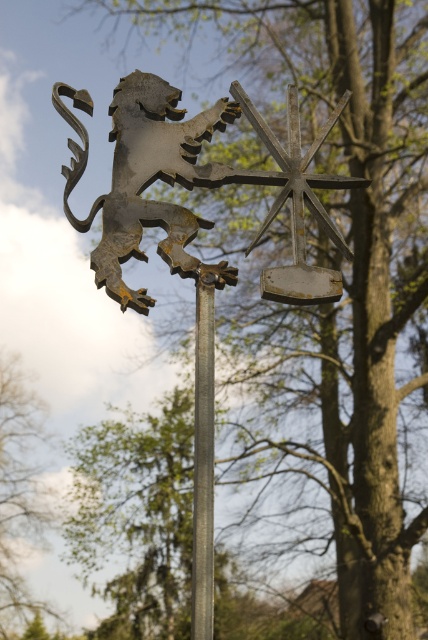
Question: Does rusty metal lion at upper left come in front of polished metal pole at center?

Choices:
 (A) no
 (B) yes

Answer: (A)

Question: Estimate the real-world distances between objects in this image. Which object is farther from the rusty metal lion at upper left?

Choices:
 (A) polished metal pole at center
 (B) green leafy tree at lower left

Answer: (B)

Question: Is rusty metal lion at upper left below polished metal pole at center?

Choices:
 (A) yes
 (B) no

Answer: (B)

Question: Among these objects, which one is farthest from the camera?

Choices:
 (A) green leafy tree at lower left
 (B) polished metal pole at center
 (C) rusty metal lion at upper left

Answer: (A)

Question: Is rusty metal lion at upper left thinner than green leafy tree at lower left?

Choices:
 (A) no
 (B) yes

Answer: (B)

Question: Among these points, which one is farthest from the camera?

Choices:
 (A) (213, 362)
 (B) (82, 157)
 (C) (17, 584)

Answer: (C)